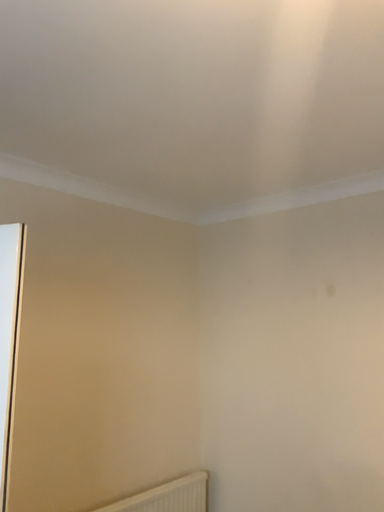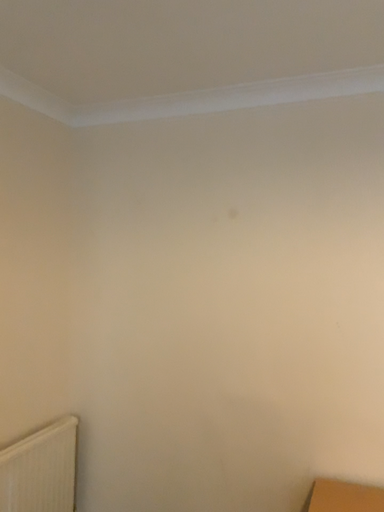
Question: How did the camera likely rotate when shooting the video?

Choices:
 (A) rotated upward
 (B) rotated downward

Answer: (B)